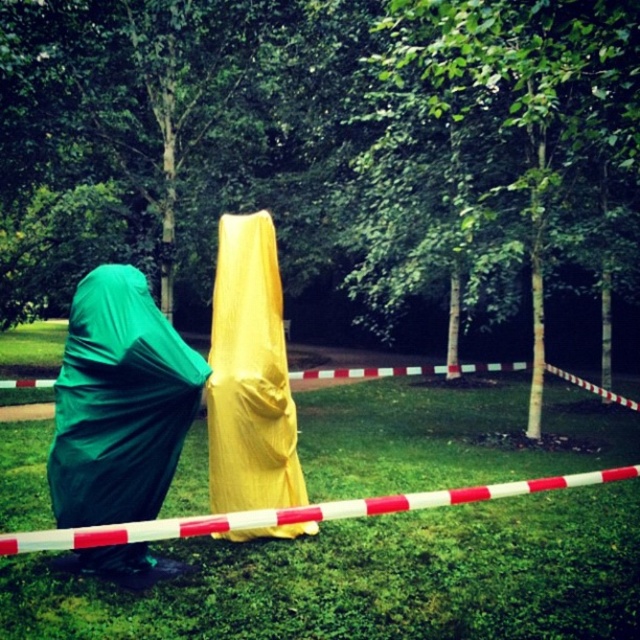
You are a park ranger inspecting the area. You need to determine which object occupies more space on the ground. Based on the scene, which one is larger between the green grass at lower center and the green fabric bag at left?

The green grass at lower center is larger in size than the green fabric bag at left, so the green grass at lower center occupies more space on the ground.

From the picture: You are a park visitor who wants to walk from the green grass at lower center to the yellow fabric cloak at center. Which direction should you move relative to the cloak?

The green grass at lower center is to the right of the yellow fabric cloak at center, so you should move to the left to reach the cloak from the grass.

You are a drone operator trying to land your drone in the park scene. The drone has a GPS coordinate system where the bottom left corner is at point 0,0 and the top right corner is at point 1,1. You want to land the drone on the green grass at lower center. What are the coordinates you should input into the drone to land it there?

The coordinates for the green grass at lower center are at point (372,579). Therefore, you should input these coordinates into the drone to land it there.